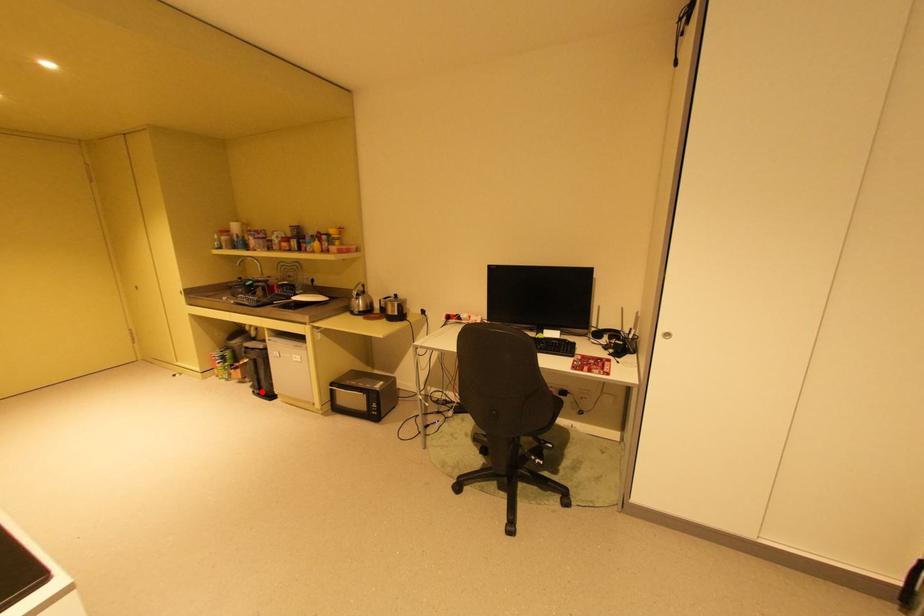
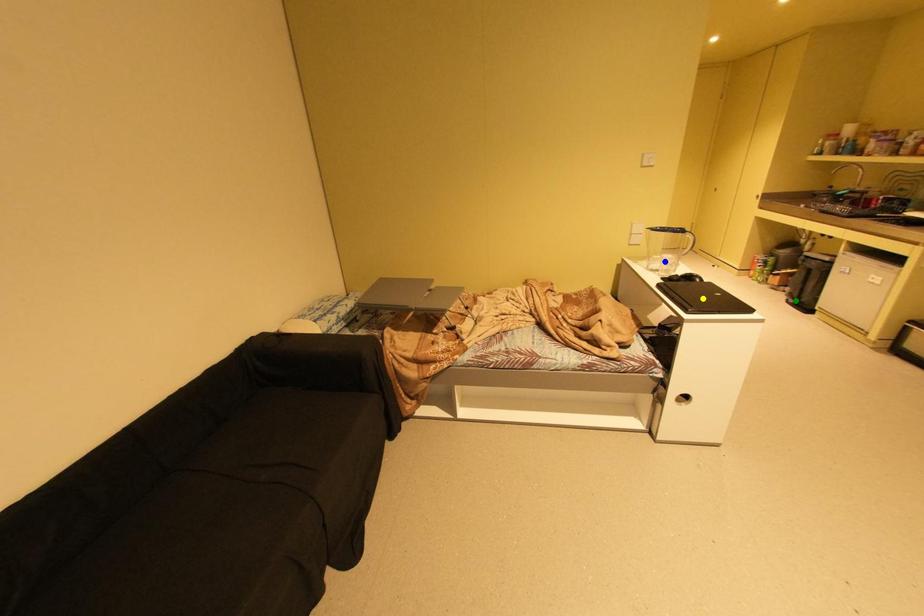
Question: I am providing you with two images of the same scene from different viewpoints. A red point is marked on the first image. You are given multiple points on the second image. Which point in image 2 is actually the same real-world point as the red point in image 1?

Choices:
 (A) green point
 (B) blue point
 (C) yellow point

Answer: (A)